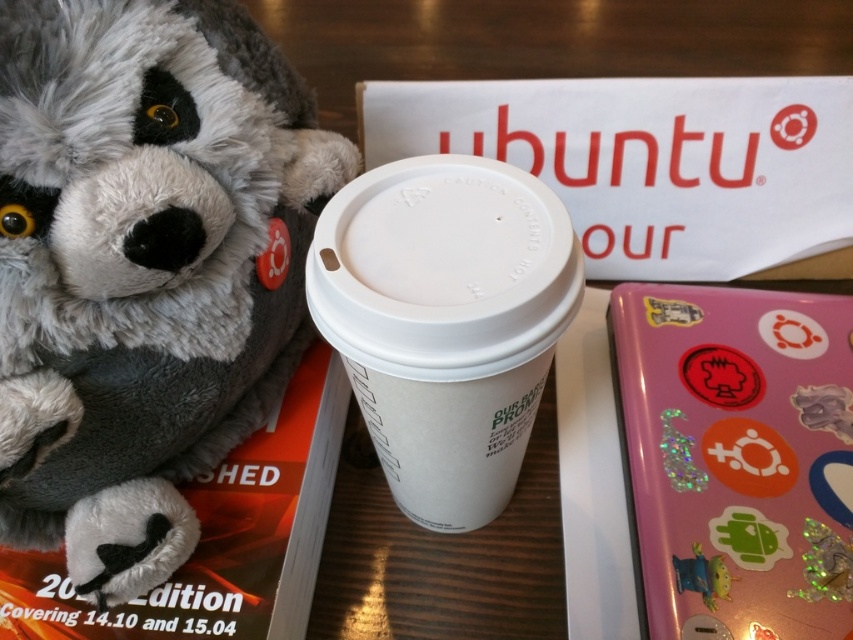
You are organizing items on a table and need to place a new item between the white paper cup at center and the glittery plastic toy at lower right. Can you fit it there?

The distance between the white paper cup at center and the glittery plastic toy at lower right is 18.02 inches, so yes, you can fit an item between them as there is sufficient space.

You are organizing items on a table and need to place a new item between the fluffy gray teddy bear at left and the glittery plastic toy at lower right. Considering their sizes, which item should you place closer to the edge of the table to avoid overcrowding?

The glittery plastic toy at lower right is shorter than the fluffy gray teddy bear at left, so placing it closer to the edge would free up space near the taller teddy bear.